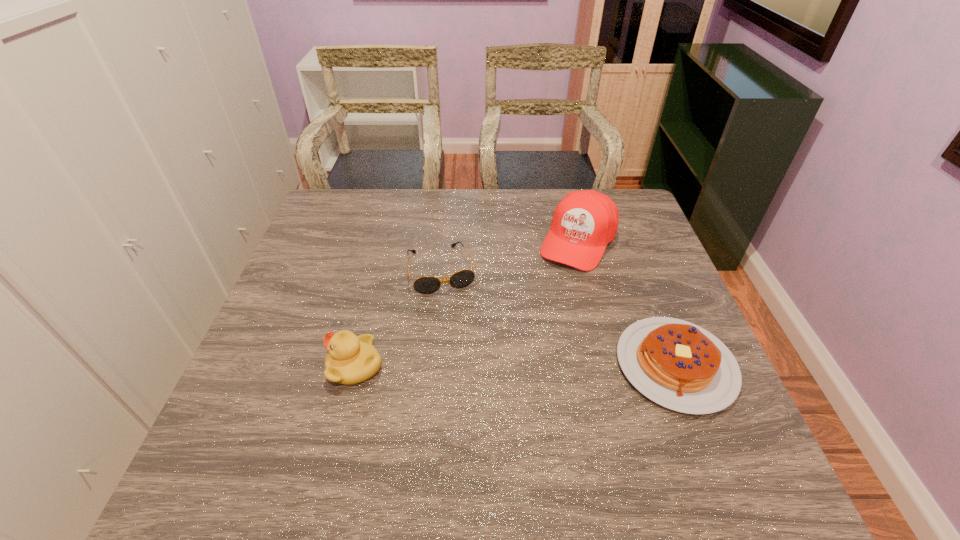
At what (x,y) coordinates should I click in order to perform the action: click on free area in between the duckling and the pancake. Please return your answer as a coordinate pair (x, y). Image resolution: width=960 pixels, height=540 pixels. Looking at the image, I should click on (516, 366).

Locate an element on the screen. free space between the tallest object and the third object from right to left is located at coordinates (510, 255).

At what (x,y) coordinates should I click in order to perform the action: click on free space between the third shortest object and the sunglasses. Please return your answer as a coordinate pair (x, y). Image resolution: width=960 pixels, height=540 pixels. Looking at the image, I should click on (398, 318).

Where is `unoccupied area between the sunglasses and the pancake`? The image size is (960, 540). unoccupied area between the sunglasses and the pancake is located at coordinates (559, 318).

This screenshot has width=960, height=540. Find the location of `empty space that is in between the third object from right to left and the leftmost object`. empty space that is in between the third object from right to left and the leftmost object is located at coordinates (398, 318).

You are a GUI agent. You are given a task and a screenshot of the screen. Output one action in this format:
    pyautogui.click(x=<x>, y=<y>)
    Task: Click on the free area in between the baseball cap and the sunglasses
    This screenshot has width=960, height=540.
    Given the screenshot: What is the action you would take?
    pyautogui.click(x=510, y=255)

In order to click on object that is the third closest to the third shortest object in this screenshot , I will do `click(677, 364)`.

Select which object appears as the closest to the pancake. Please provide its 2D coordinates. Your answer should be formatted as a tuple, i.e. [(x, y)], where the tuple contains the x and y coordinates of a point satisfying the conditions above.

[(584, 222)]

Where is `vacant space that satisfies the following two spatial constraints: 1. on the front side of the sunglasses; 2. on the right side of the pancake`? This screenshot has width=960, height=540. vacant space that satisfies the following two spatial constraints: 1. on the front side of the sunglasses; 2. on the right side of the pancake is located at coordinates (433, 365).